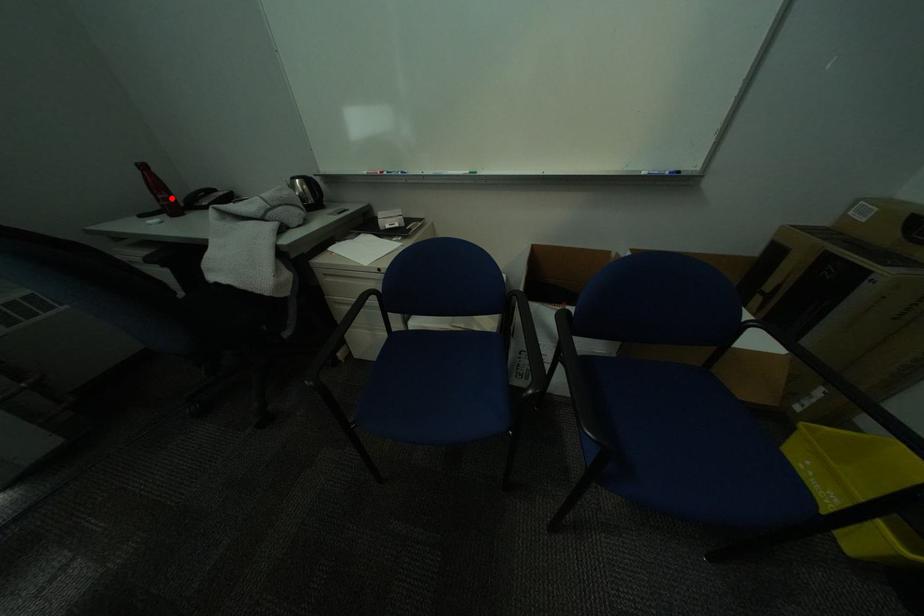
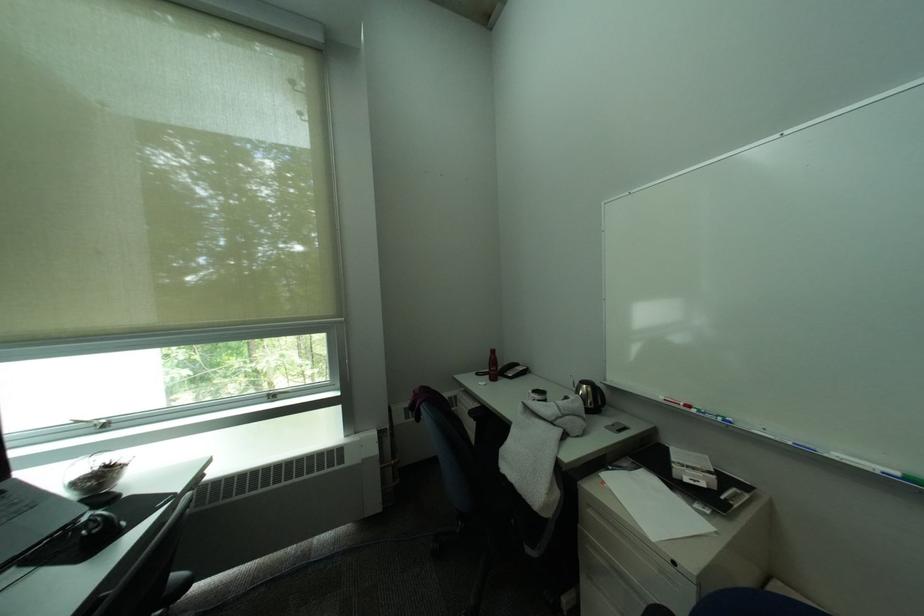
Find the pixel in the second image that matches the highlighted location in the first image.

(503, 370)